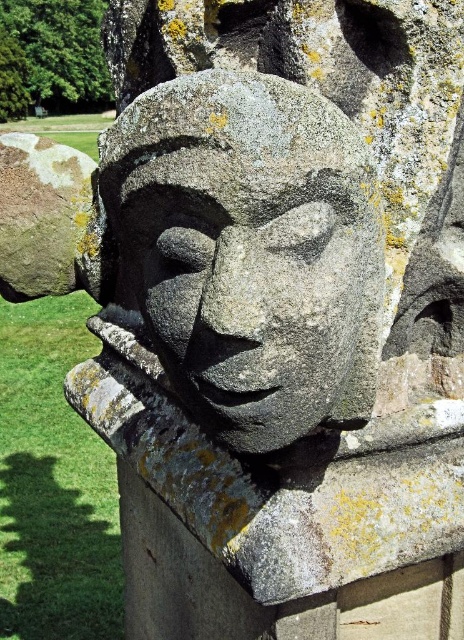
You are an art conservator examining the sculpture from a distance of 2 meters. You notice the gray stone face at center and the speckled gray rock at upper left. Which object would appear larger to you?

The gray stone face at center would appear larger because it is closer to the viewer than the speckled gray rock at upper left.

You are an architect examining the sculpture and its placement. You need to determine the relative positions of the gray stone face at center and the speckled gray rock at upper left. Which object is positioned higher in the image?

The speckled gray rock at upper left is positioned higher than the gray stone face at center, as it is located above it in the image.

Based on the photo, you are a photographer standing in front of the gray stone face at center. You want to capture a closeup shot of the point at coordinates (250, 252). Can you confirm if this point is located on the gray stone face at center?

The gray stone face at center is represented by point (250, 252), so yes, the point is located on the gray stone face at center.